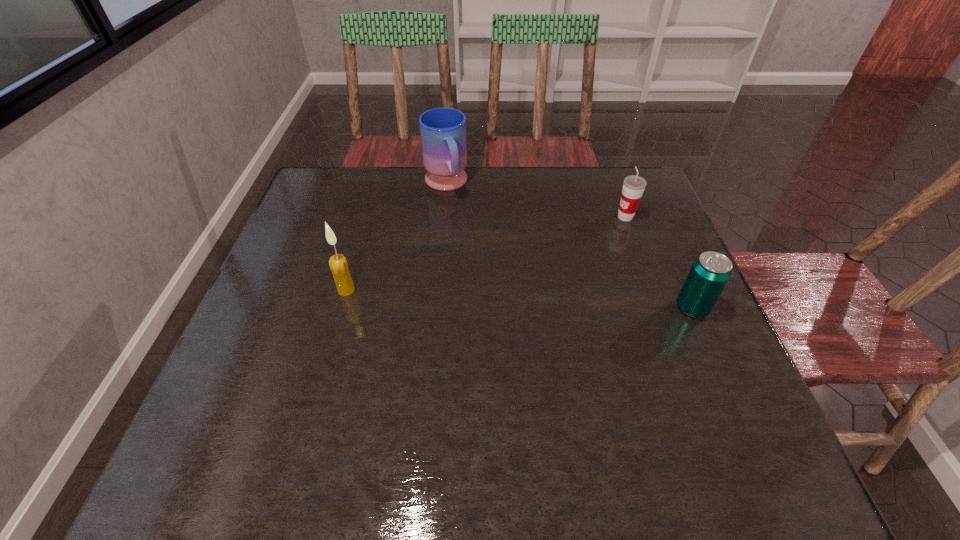
Where is `the leftmost object`? The height and width of the screenshot is (540, 960). the leftmost object is located at coordinates (338, 264).

Locate an element on the screen. the rightmost object is located at coordinates (709, 274).

The image size is (960, 540). Identify the location of the second farthest object. (633, 185).

Locate an element on the screen. This screenshot has width=960, height=540. the third object from left to right is located at coordinates (633, 185).

You are a GUI agent. You are given a task and a screenshot of the screen. Output one action in this format:
    pyautogui.click(x=<x>, y=<y>)
    Task: Click on the mug
    This screenshot has height=540, width=960.
    Given the screenshot: What is the action you would take?
    pyautogui.click(x=442, y=130)

I want to click on the third object from right to left, so click(442, 130).

At what (x,y) coordinates should I click in order to perform the action: click on blank space located on the front of the candle. Please return your answer as a coordinate pair (x, y). This screenshot has height=540, width=960. Looking at the image, I should click on (335, 331).

This screenshot has height=540, width=960. In order to click on vacant space located 0.140m on the back of the beer can in this screenshot , I will do `click(668, 254)`.

You are a GUI agent. You are given a task and a screenshot of the screen. Output one action in this format:
    pyautogui.click(x=<x>, y=<y>)
    Task: Click on the free space located 0.270m on the side of the third nearest object with the logo
    
    Given the screenshot: What is the action you would take?
    pyautogui.click(x=545, y=262)

You are a GUI agent. You are given a task and a screenshot of the screen. Output one action in this format:
    pyautogui.click(x=<x>, y=<y>)
    Task: Click on the vacant space located on the side of the third nearest object with the logo
    The image size is (960, 540).
    Given the screenshot: What is the action you would take?
    pyautogui.click(x=511, y=281)